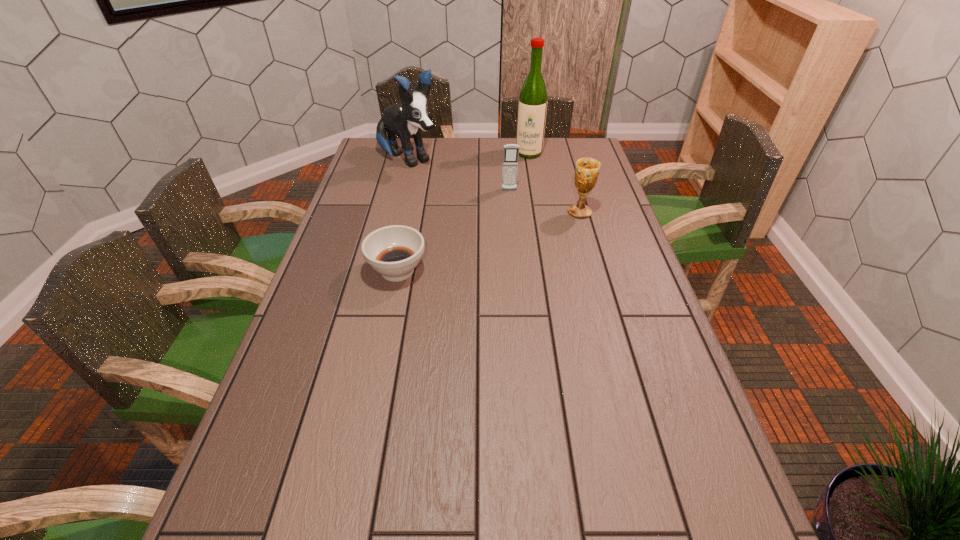
The image size is (960, 540). I want to click on free space between the fourth shortest object and the shortest object, so click(403, 215).

Locate which object ranks in proximity to the second nearest object. Please provide its 2D coordinates. Your answer should be formatted as a tuple, i.e. [(x, y)], where the tuple contains the x and y coordinates of a point satisfying the conditions above.

[(511, 151)]

Identify which object is located as the second nearest to the shortest object. Please provide its 2D coordinates. Your answer should be formatted as a tuple, i.e. [(x, y)], where the tuple contains the x and y coordinates of a point satisfying the conditions above.

[(406, 119)]

Locate an element on the screen. This screenshot has height=540, width=960. free location that satisfies the following two spatial constraints: 1. on the back side of the fourth shortest object; 2. on the left side of the second object from right to left is located at coordinates (410, 153).

I want to click on vacant space that satisfies the following two spatial constraints: 1. on the back side of the shortest object; 2. on the left side of the liquor, so click(x=421, y=153).